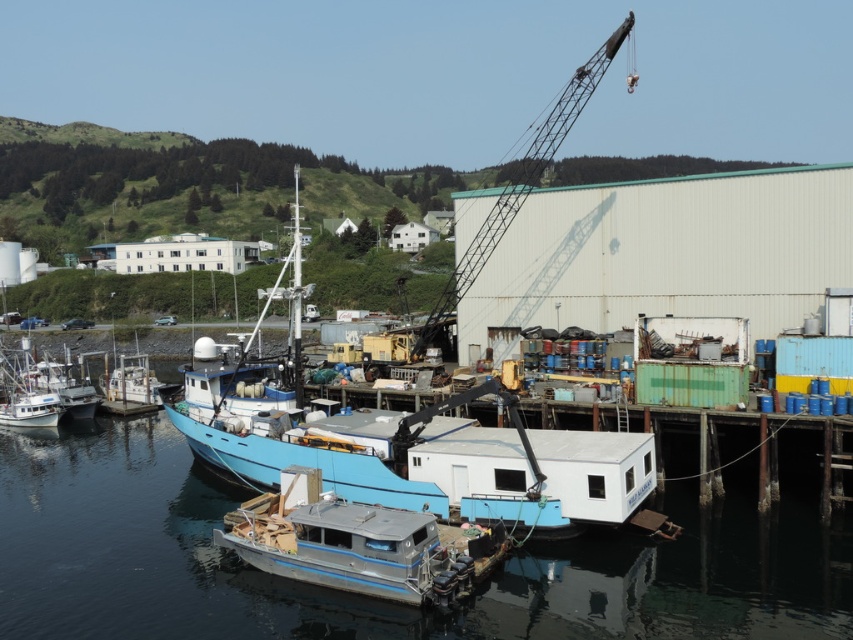
You are a dock worker trying to secure both the metallic gray pontoon boat at center and the blue matte boat at center. Which boat should you attend to first if you want to start with the one that is closer to your current position on the dock?

You should attend to the metallic gray pontoon boat at center first because it is closer to your current position on the dock than the blue matte boat at center.

You are standing at the point marked as point (358,544) in the harbor scene. What type of boat are you currently on?

The point (358,544) is on a metallic gray pontoon boat at center, so you are currently on a metallic gray pontoon boat at center.

Looking at this image, you are a photographer standing at the pier and want to capture the blue matte boat at center in your shot. The camera you are using has a maximum focus range of 30 meters. Will the boat be in focus?

The blue matte boat at center is 28.07 meters from camera, which is within the camera maximum focus range of 30 meters. Therefore, the boat will be in focus.